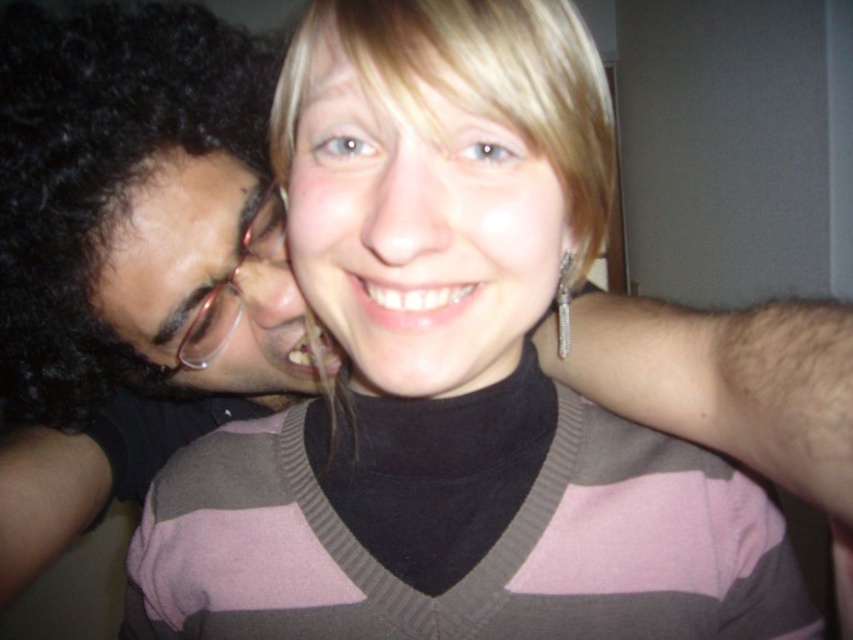
You are a photographer trying to capture a portrait of the two people in the scene. You want to ensure that both the blonde hair at center and the matte black glasses at left are clearly visible in the frame. Based on their positions, which object should you focus on first to ensure proper depth of field?

You should focus on the matte black glasses at left first because it is closer to the camera than the blonde hair at center, ensuring both will be in focus with proper depth of field.